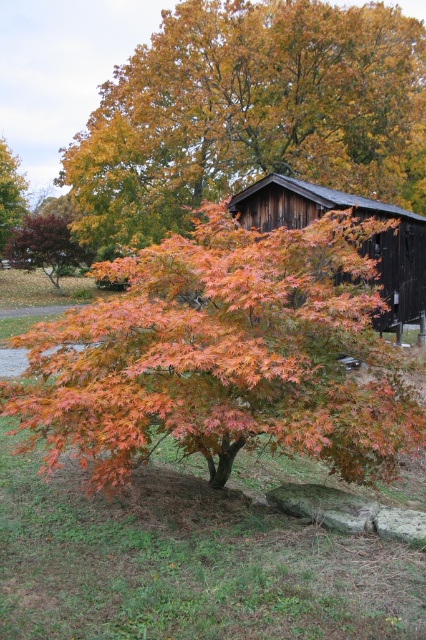
You are a painter standing at the edge of a field, looking at the orange matte tree at center and the dark brown wooden barn at center. Which object is taller?

The orange matte tree at center is taller than the dark brown wooden barn at center according to the description provided.